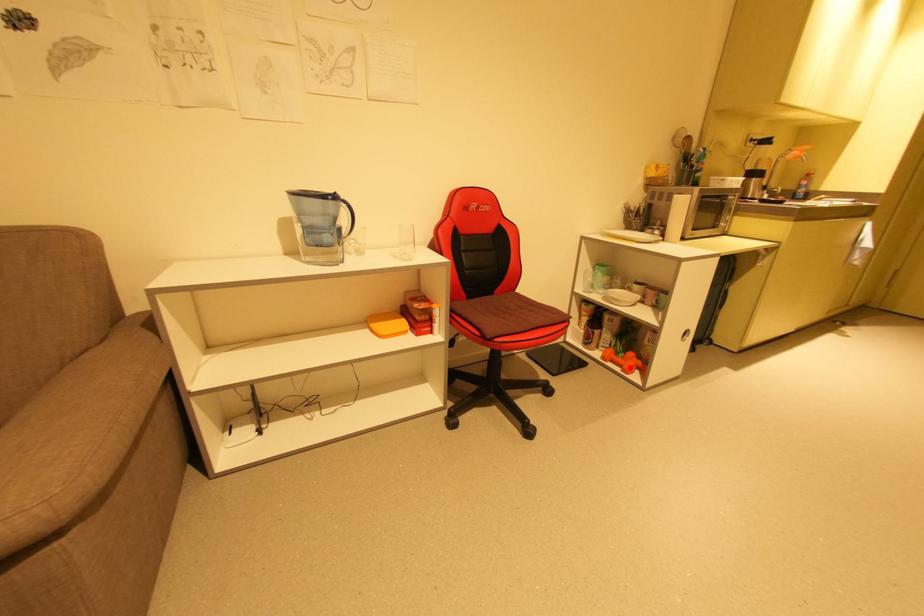
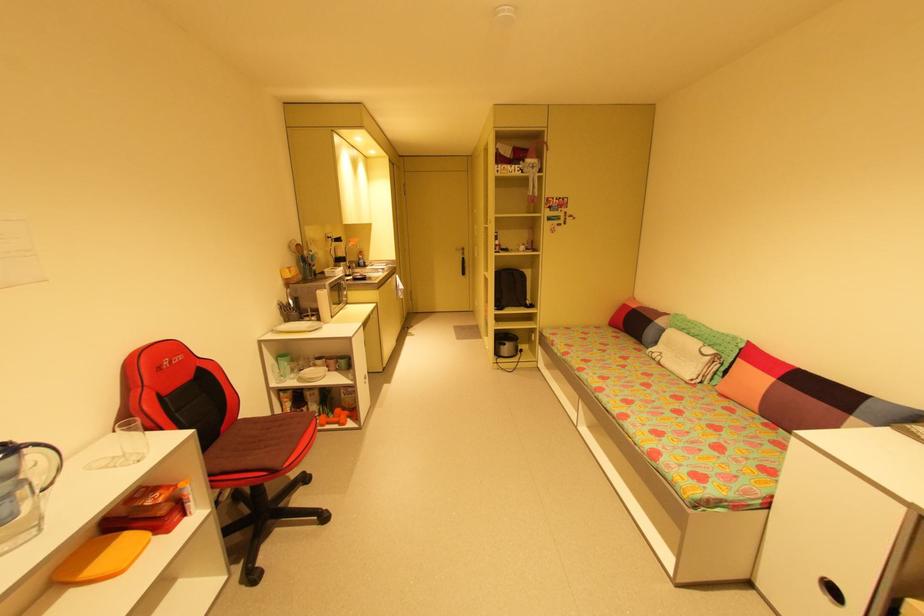
Find the pixel in the second image that matches the highlighted location in the first image.

(345, 422)